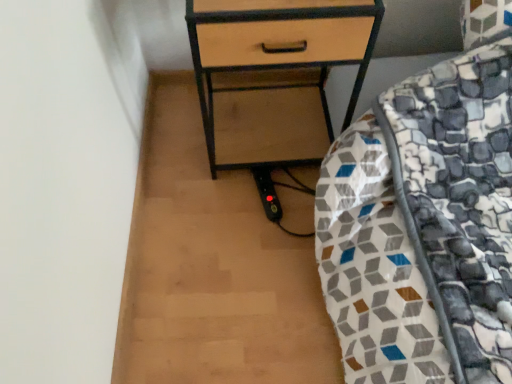
I want to click on woodenmaterial/texturechest of drawers at upper center, so 276,69.

Describe the element at coordinates (276, 69) in the screenshot. I see `woodenmaterial/texturechest of drawers at upper center` at that location.

You are a GUI agent. You are given a task and a screenshot of the screen. Output one action in this format:
    pyautogui.click(x=<x>, y=<y>)
    Task: Click on the woodenmaterial/texturechest of drawers at upper center
    
    Given the screenshot: What is the action you would take?
    pyautogui.click(x=276, y=69)